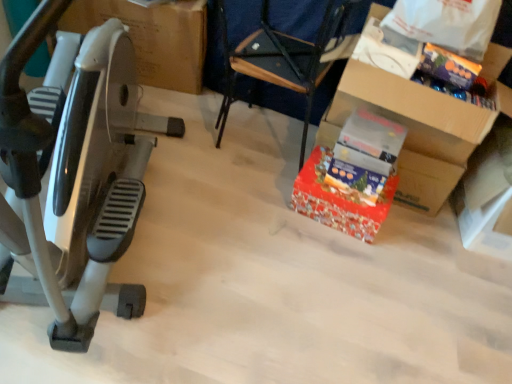
Identify the location of vacant area situated to the left side of white cardboard box at right. (415, 241).